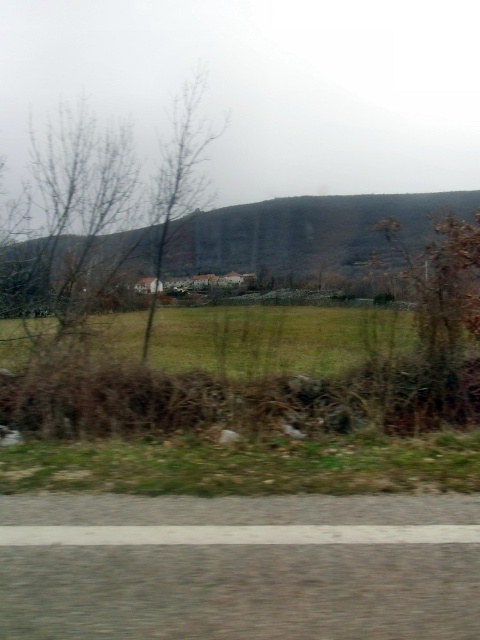
Question: Which object is closer to the camera taking this photo?

Choices:
 (A) bare branches at left
 (B) green grassy field at center

Answer: (B)

Question: Which point is closer to the camera?

Choices:
 (A) green grassy field at center
 (B) bare branches at left

Answer: (A)

Question: Is bare branches at left smaller than green grassy field at center?

Choices:
 (A) no
 (B) yes

Answer: (A)

Question: Is bare branches at left below green grassy field at center?

Choices:
 (A) yes
 (B) no

Answer: (B)

Question: Among these objects, which one is nearest to the camera?

Choices:
 (A) bare branches at left
 (B) green grassy field at center

Answer: (B)

Question: Where is bare branches at left located in relation to green grassy field at center in the image?

Choices:
 (A) above
 (B) below

Answer: (A)